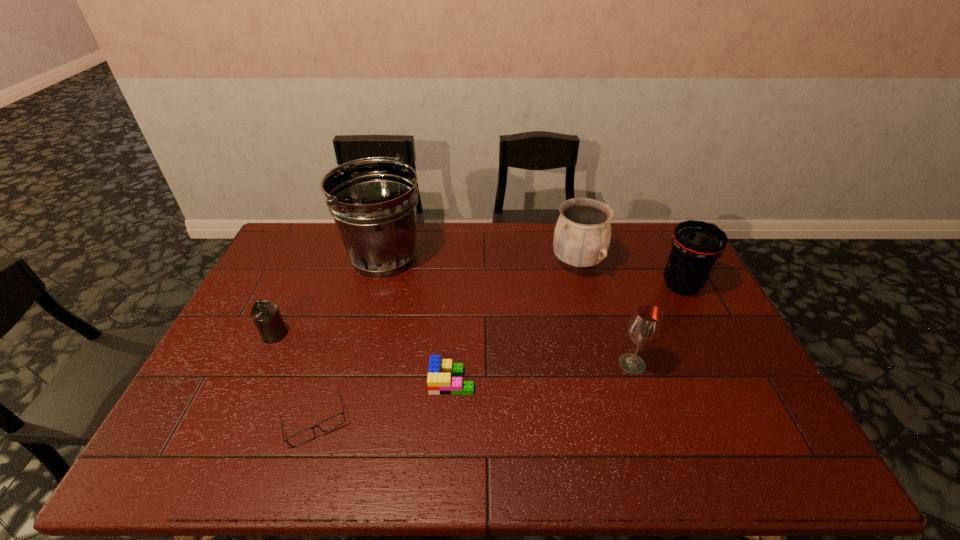
In the image, there is a desktop. Where is `vacant space at the far edge`? This screenshot has width=960, height=540. vacant space at the far edge is located at coordinates (420, 226).

Identify the location of free region at the near edge. The width and height of the screenshot is (960, 540). (260, 445).

Where is `vacant space at the left edge of the desktop`? The width and height of the screenshot is (960, 540). vacant space at the left edge of the desktop is located at coordinates (306, 264).

At what (x,y) coordinates should I click in order to perform the action: click on empty space between the urn and the Lego. Please return your answer as a coordinate pair (x, y). This screenshot has height=540, width=960. Looking at the image, I should click on (515, 322).

You are a GUI agent. You are given a task and a screenshot of the screen. Output one action in this format:
    pyautogui.click(x=<x>, y=<y>)
    Task: Click on the unoccupied position between the Lego and the telephoto lens
    This screenshot has width=960, height=540.
    Given the screenshot: What is the action you would take?
    pyautogui.click(x=566, y=333)

I want to click on vacant space in between the rightmost object and the urn, so click(630, 274).

Find the location of `vacant area that lies between the rightmost object and the urn`. vacant area that lies between the rightmost object and the urn is located at coordinates (630, 274).

Locate an element on the screen. This screenshot has height=540, width=960. free spot between the fourth object from right to left and the telephoto lens is located at coordinates (566, 333).

This screenshot has width=960, height=540. I want to click on empty space that is in between the fourth nearest object and the telephoto lens, so click(478, 309).

The image size is (960, 540). Find the location of `empty space between the urn and the fourth object from left to right`. empty space between the urn and the fourth object from left to right is located at coordinates (515, 322).